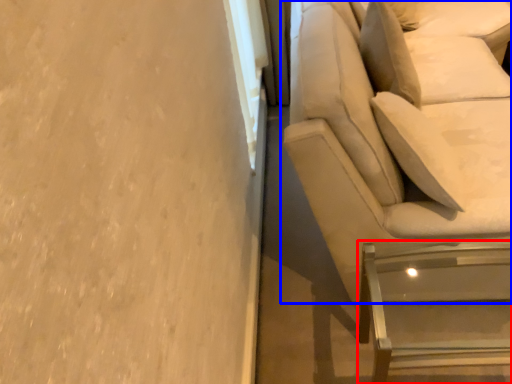
Question: Among these objects, which one is farthest to the camera, furniture (highlighted by a red box) or studio couch (highlighted by a blue box)?

Choices:
 (A) furniture
 (B) studio couch

Answer: (A)